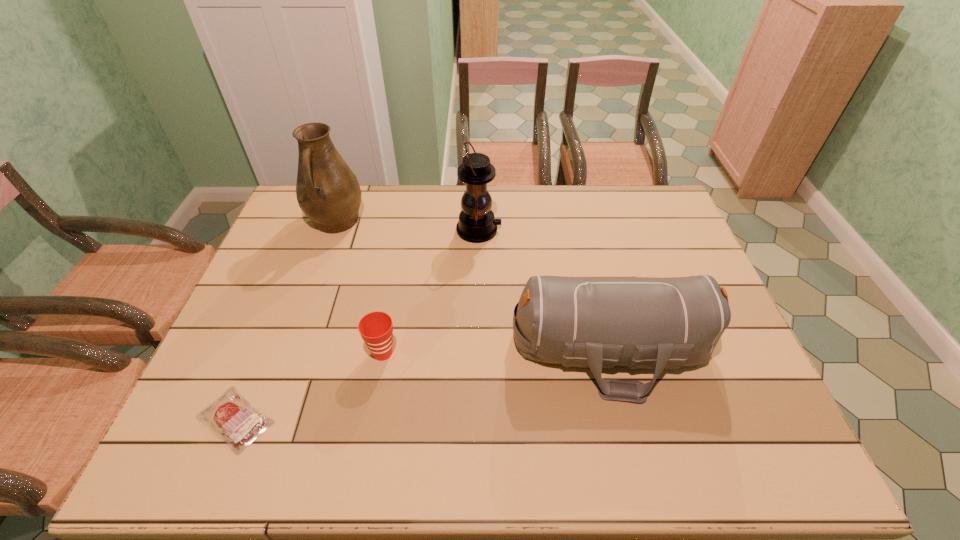
This screenshot has height=540, width=960. What are the coordinates of `pitcher` in the screenshot? It's located at (328, 192).

This screenshot has height=540, width=960. What are the coordinates of `lantern` in the screenshot? It's located at (476, 224).

Locate an element on the screen. The image size is (960, 540). duffel bag is located at coordinates (655, 323).

Locate an element on the screen. This screenshot has width=960, height=540. the rightmost object is located at coordinates (655, 323).

I want to click on the fourth tallest object, so click(376, 328).

The image size is (960, 540). Find the location of `the third object from right to left`. the third object from right to left is located at coordinates (376, 328).

Identify the location of the shortest object. (231, 416).

This screenshot has height=540, width=960. I want to click on vacant space located 0.370m on the handle side of the pitcher, so click(295, 338).

Find a few locations in blank space located above the second object from right to left, indicating its light source. Please provide its 2D coordinates. Your answer should be formatted as a tuple, i.e. [(x, y)], where the tuple contains the x and y coordinates of a point satisfying the conditions above.

[(614, 230)]

Locate an element on the screen. vacant space located on the back of the duffel bag is located at coordinates (582, 231).